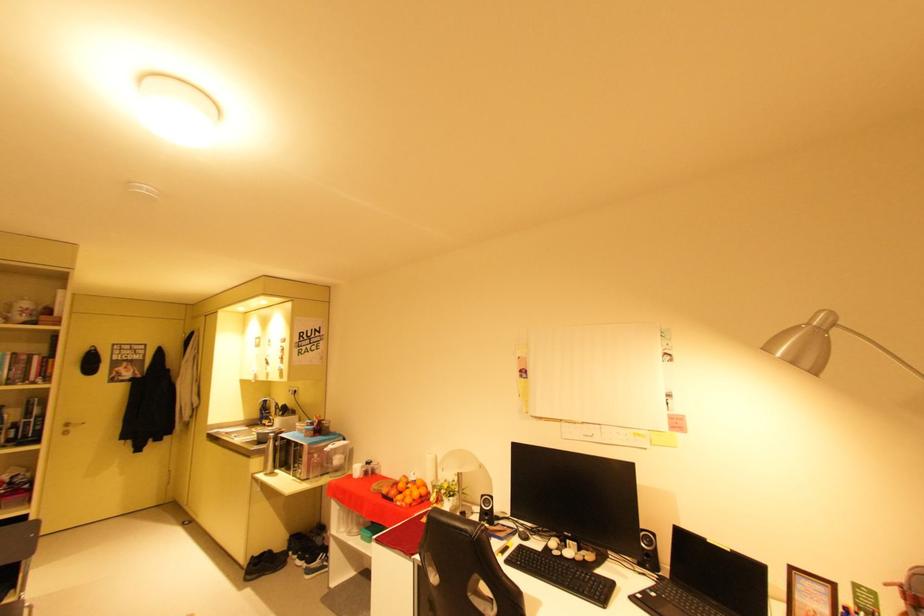
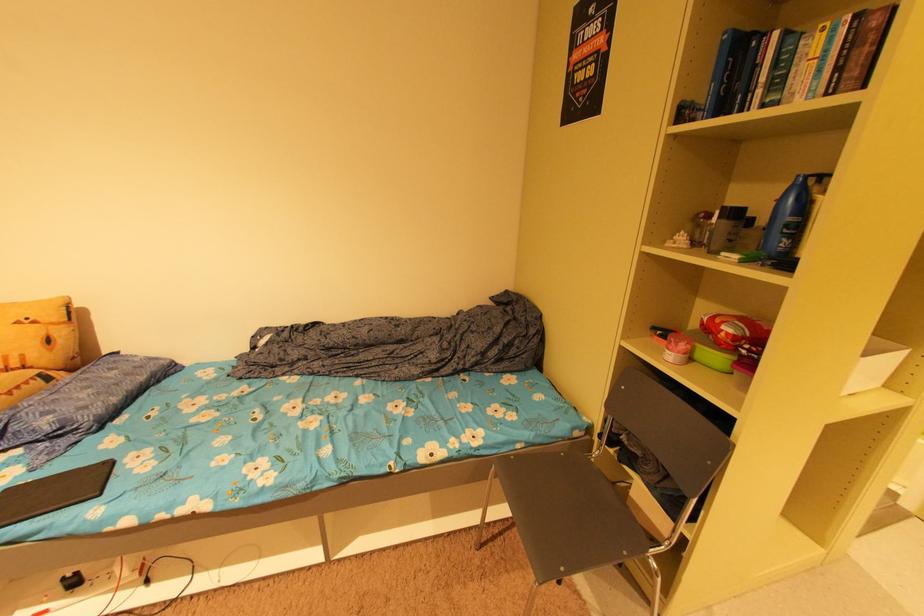
Locate, in the second image, the point that corresponds to [31,358] in the first image.

(882, 22)